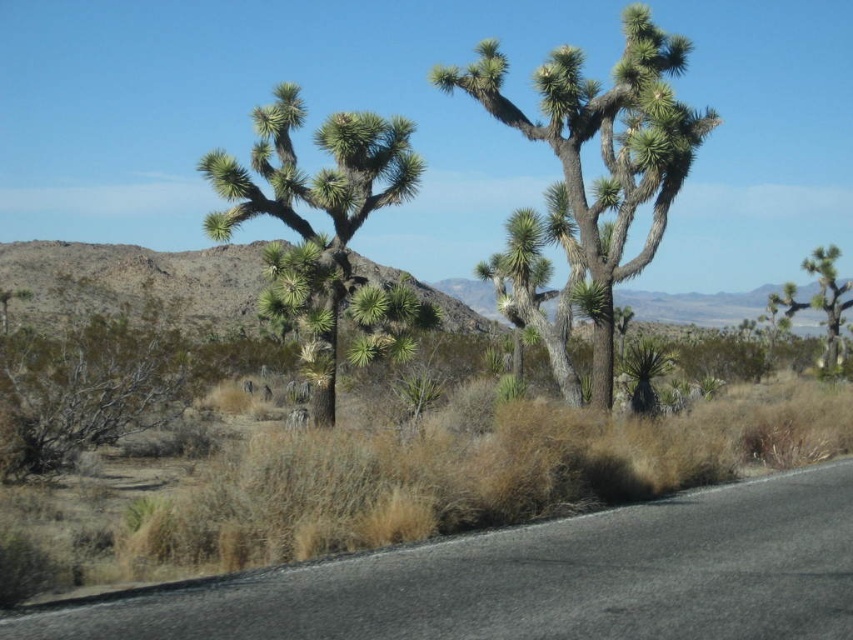
Is green spiky plant at center further to the viewer compared to green spiky cactus at right?

No, it is not.

This screenshot has width=853, height=640. Describe the element at coordinates (323, 234) in the screenshot. I see `green spiky plant at center` at that location.

Is point (380, 292) closer to viewer compared to point (809, 273)?

Yes.

The height and width of the screenshot is (640, 853). I want to click on green spiky plant at center, so click(x=323, y=234).

Who is more forward, (270, 118) or (665, 45)?

Point (270, 118) is in front.

Can you confirm if green spiky plant at center is bigger than green spiky cactus at center?

→ No.

Where is `green spiky plant at center`? green spiky plant at center is located at coordinates (323, 234).

Which of these two, green spiky cactus at center or green spiky cactus at right, stands shorter?

green spiky cactus at right is shorter.

What do you see at coordinates (602, 150) in the screenshot? I see `green spiky cactus at center` at bounding box center [602, 150].

Where is `green spiky cactus at center`? Image resolution: width=853 pixels, height=640 pixels. green spiky cactus at center is located at coordinates (602, 150).